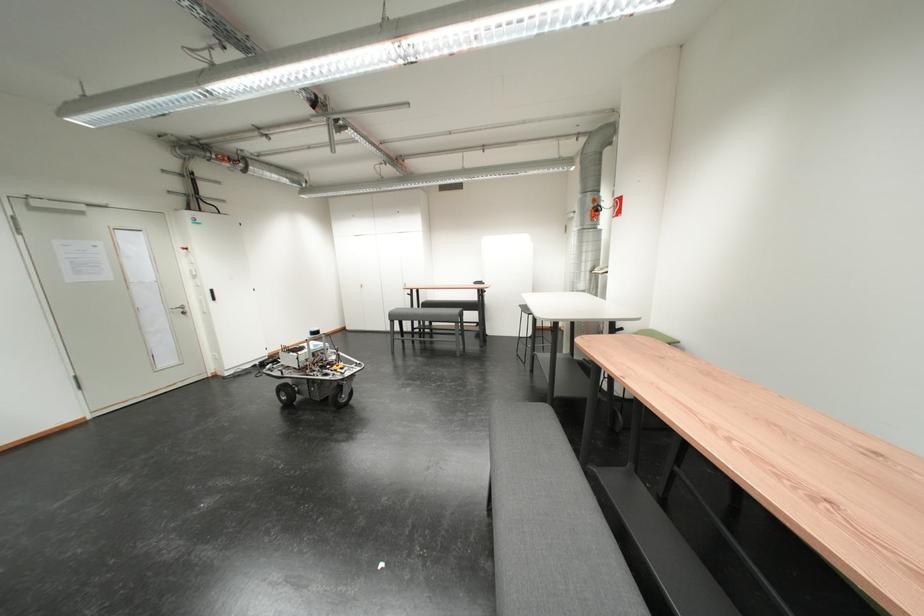
Find where to pull the white cabinet handle. Please return your answer as a coordinate pair (x, y).

(179, 309)